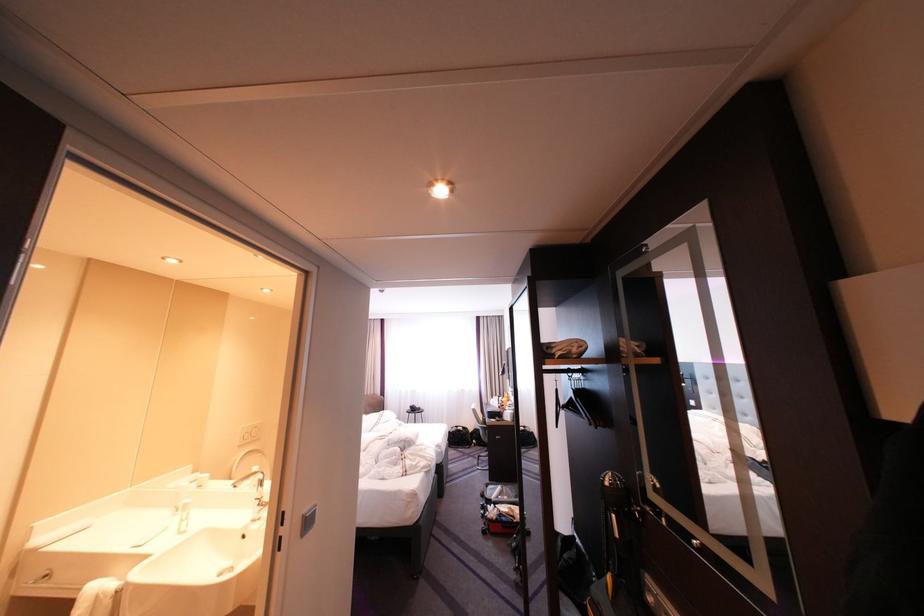
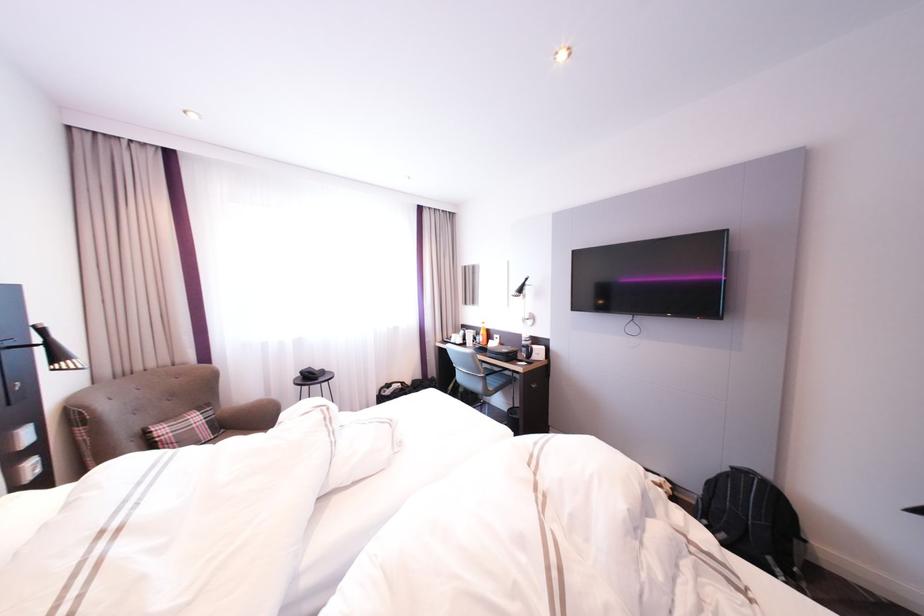
Find the pixel in the second image that matches (x=491, y=424) in the first image.

(492, 373)